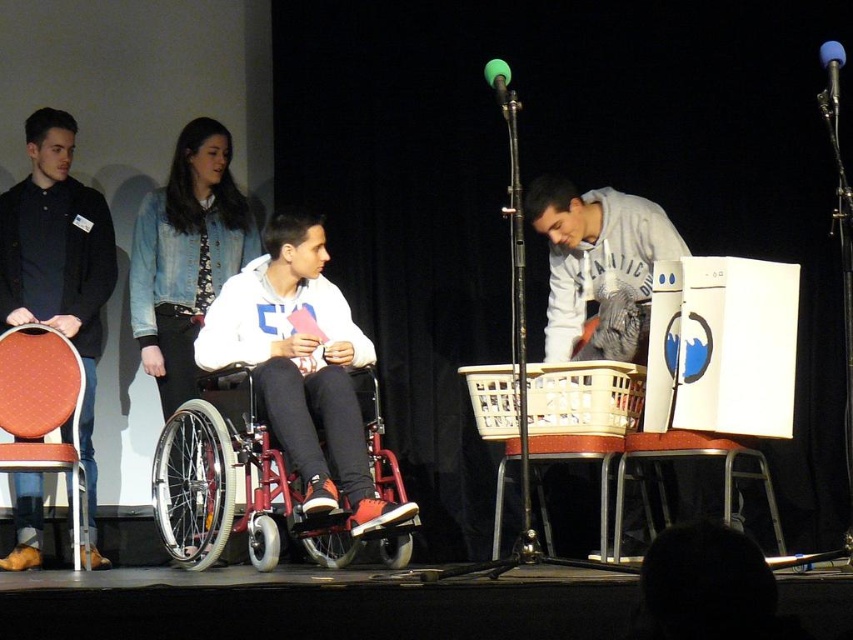
Does metallic red wheelchair at center have a larger size compared to red fabric chair at left?

Yes, metallic red wheelchair at center is bigger than red fabric chair at left.

Who is more distant from viewer, (x=386, y=464) or (x=32, y=554)?

Positioned behind is point (x=386, y=464).

The image size is (853, 640). I want to click on metallic red wheelchair at center, so click(247, 490).

Does metallic red wheelchair at center have a smaller size compared to denim jacket at upper left?

No.

Who is more distant from viewer, (245, 492) or (186, 326)?

The point (186, 326) is behind.

Does point (207, 428) come farther from viewer compared to point (138, 301)?

No, it is not.

You are a GUI agent. You are given a task and a screenshot of the screen. Output one action in this format:
    pyautogui.click(x=<x>, y=<y>)
    Task: Click on the metallic red wheelchair at center
    
    Given the screenshot: What is the action you would take?
    pyautogui.click(x=247, y=490)

Between metallic red wheelchair at center and blue foam microphone at upper right, which one has less height?

Standing shorter between the two is blue foam microphone at upper right.

Where is `metallic red wheelchair at center`? Image resolution: width=853 pixels, height=640 pixels. metallic red wheelchair at center is located at coordinates (247, 490).

Locate an element on the screen. The height and width of the screenshot is (640, 853). metallic red wheelchair at center is located at coordinates (247, 490).